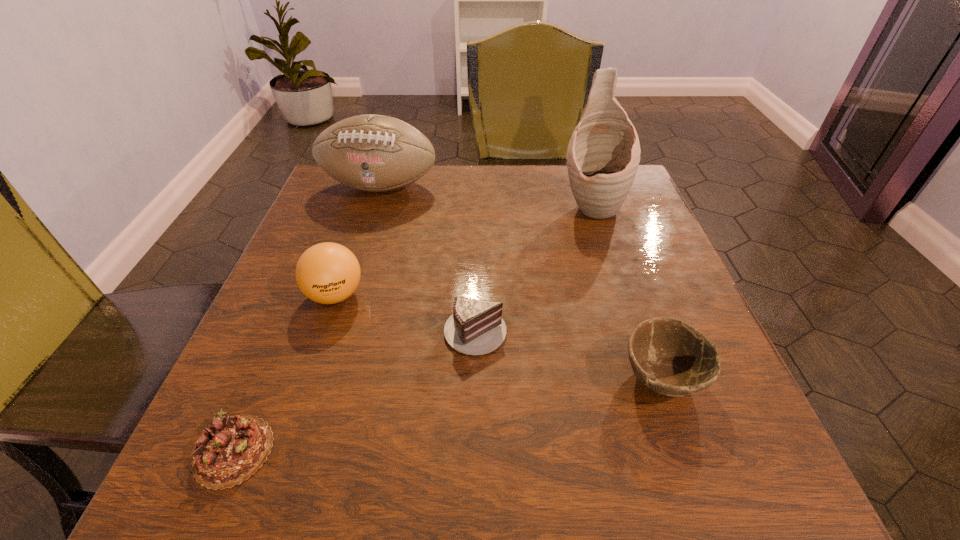
This screenshot has width=960, height=540. I want to click on free space between the nearest object and the pitcher, so click(413, 329).

Select which object appears as the third closest to the pitcher. Please provide its 2D coordinates. Your answer should be formatted as a tuple, i.e. [(x, y)], where the tuple contains the x and y coordinates of a point satisfying the conditions above.

[(669, 356)]

Image resolution: width=960 pixels, height=540 pixels. I want to click on object that ranks as the fourth closest to the pitcher, so point(327,273).

You are a GUI agent. You are given a task and a screenshot of the screen. Output one action in this format:
    pyautogui.click(x=<x>, y=<y>)
    Task: Click on the vacant space that satisfies the following two spatial constraints: 1. on the side with brand of the ping-pong ball; 2. on the left side of the bowl
    The image size is (960, 540).
    Given the screenshot: What is the action you would take?
    pyautogui.click(x=307, y=378)

Locate an element on the screen. This screenshot has height=540, width=960. free spot that satisfies the following two spatial constraints: 1. on the side with brand of the fourth shortest object; 2. on the right side of the right chocolate cake is located at coordinates (324, 329).